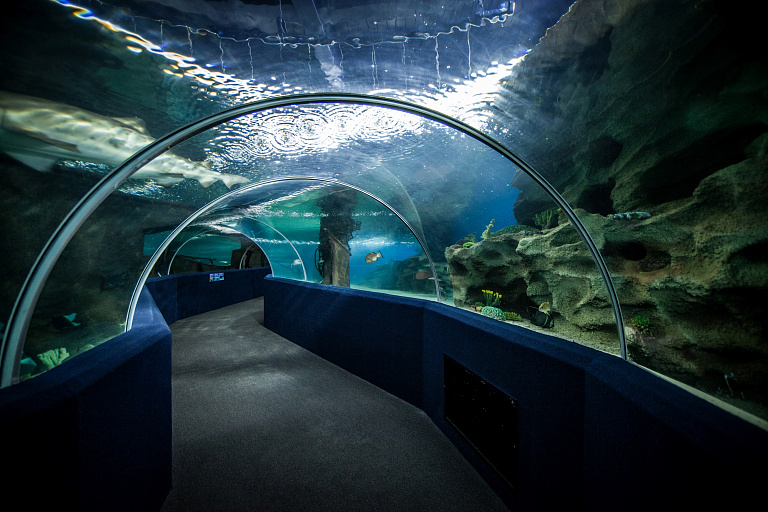
Image resolution: width=768 pixels, height=512 pixels. What are the coordinates of `white light` in the screenshot? It's located at (x=471, y=88), (x=392, y=119), (x=293, y=124), (x=316, y=115), (x=369, y=115), (x=462, y=98).